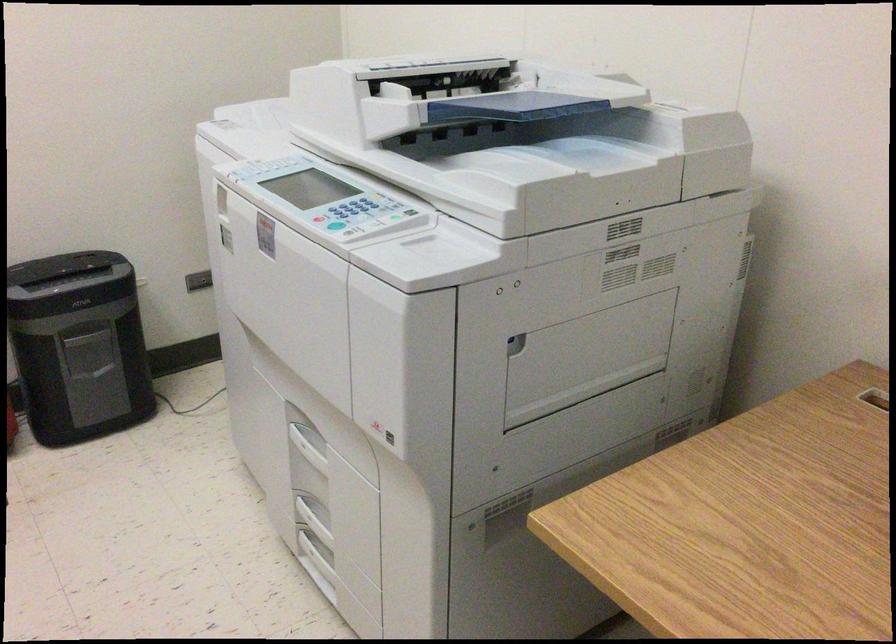
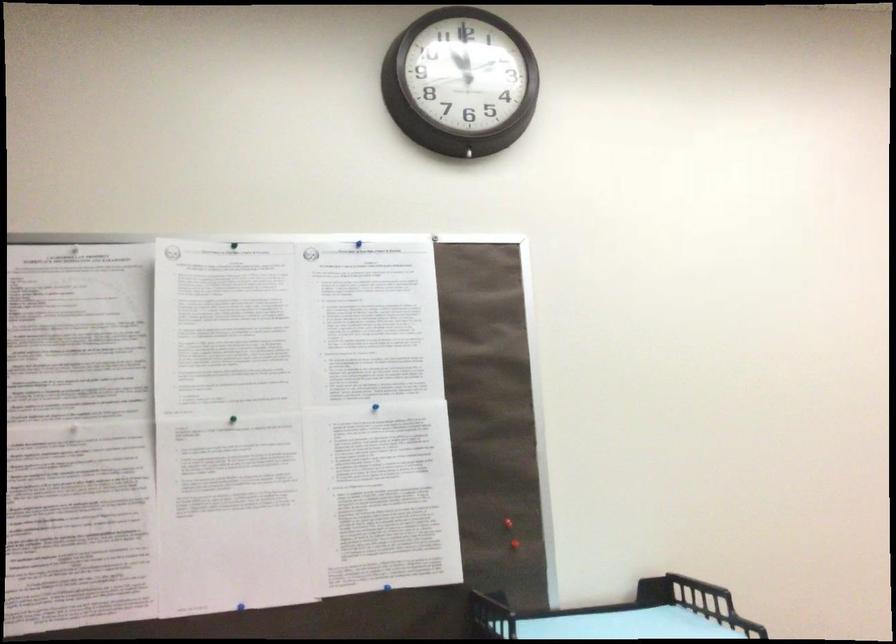
Question: The first image is from the beginning of the video and the second image is from the end. How did the camera likely rotate when shooting the video?

Choices:
 (A) Left
 (B) Right
 (C) Up
 (D) Down

Answer: (A)